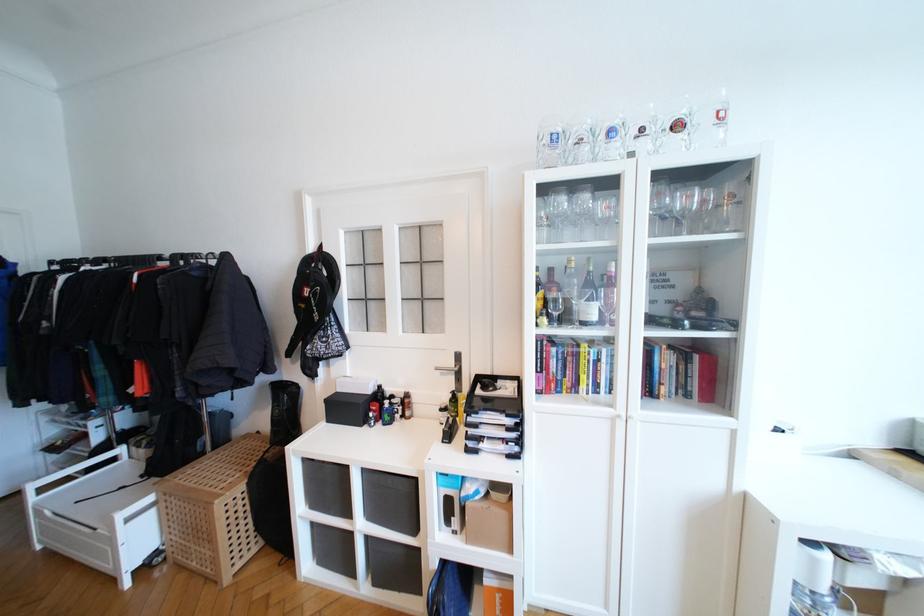
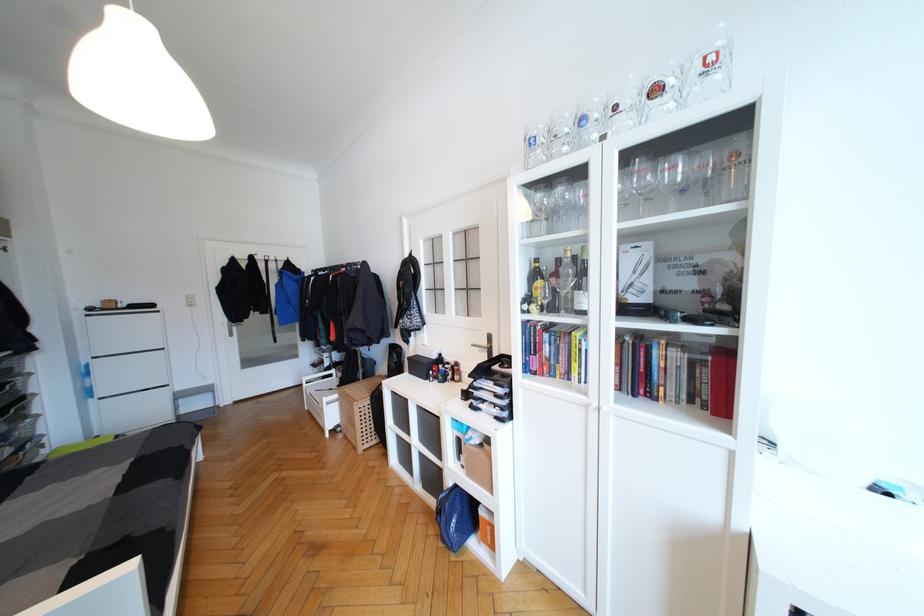
Question: How did the camera likely rotate?

Choices:
 (A) Left
 (B) Right
 (C) Up
 (D) Down

Answer: (A)